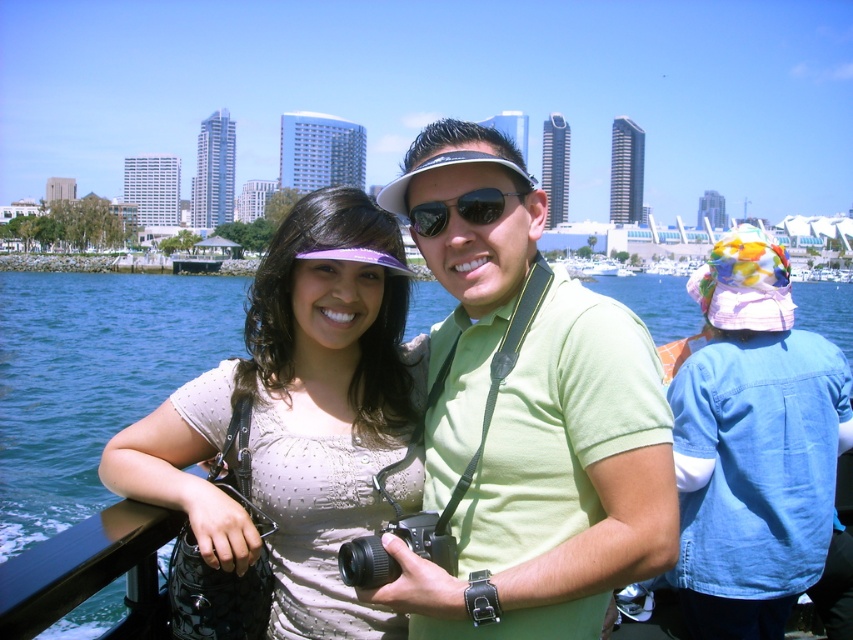
Does black plastic camera at center have a lesser height compared to sunglasses at center?

No, black plastic camera at center is not shorter than sunglasses at center.

Between black plastic camera at center and sunglasses at center, which one appears on the left side from the viewer's perspective?

black plastic camera at center is more to the left.

This screenshot has height=640, width=853. Find the location of `black plastic camera at center`. black plastic camera at center is located at coordinates (405, 545).

Is point (821, 332) positioned in front of point (421, 220)?

No.

Who is positioned more to the right, blue water at lower left or sunglasses at center?

blue water at lower left

Does point (100, 392) come in front of point (431, 212)?

No.

Find the location of a particular element. blue water at lower left is located at coordinates (91, 378).

Who is positioned more to the right, matte beige blouse at center or black plastic camera at center?

Positioned to the right is black plastic camera at center.

Can you confirm if matte beige blouse at center is bigger than black plastic camera at center?

Indeed, matte beige blouse at center has a larger size compared to black plastic camera at center.

Is point (276, 582) farther from camera compared to point (357, 564)?

Yes, it is.

Where is `matte beige blouse at center`? matte beige blouse at center is located at coordinates pyautogui.click(x=297, y=413).